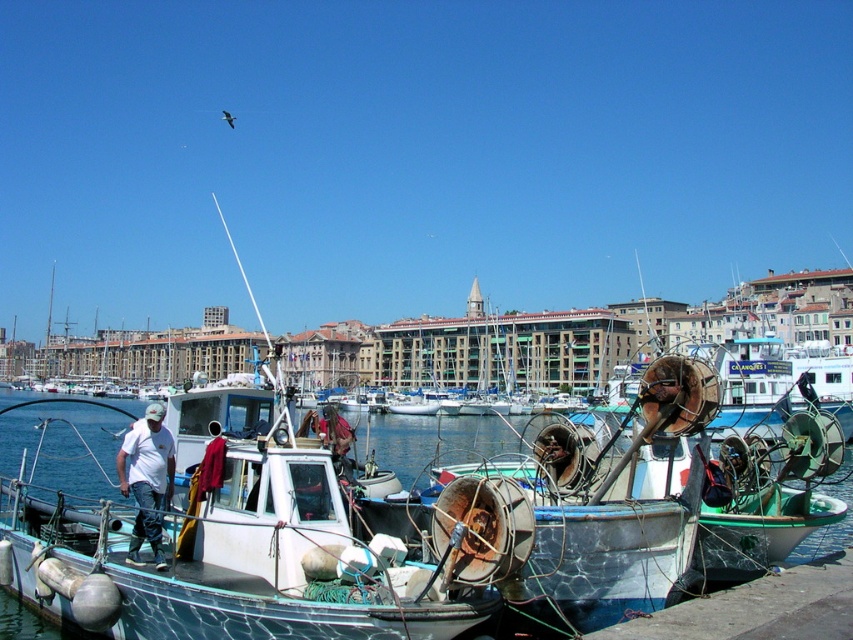
Question: Among these points, which one is farthest from the camera?

Choices:
 (A) (158, 444)
 (B) (338, 420)

Answer: (B)

Question: Which object appears farthest from the camera in this image?

Choices:
 (A) white matte water at center
 (B) white matte shirt at center
 (C) rusty metal helmet at center

Answer: (C)

Question: Which of the following is the closest to the observer?

Choices:
 (A) (318, 420)
 (B) (389, 424)
 (C) (167, 470)

Answer: (C)

Question: Does white matte water at center have a smaller size compared to rusty metal helmet at center?

Choices:
 (A) no
 (B) yes

Answer: (A)

Question: Is white matte shirt at center to the left of rusty metal helmet at center from the viewer's perspective?

Choices:
 (A) yes
 (B) no

Answer: (A)

Question: Is white matte shirt at center bigger than rusty metal helmet at center?

Choices:
 (A) no
 (B) yes

Answer: (A)